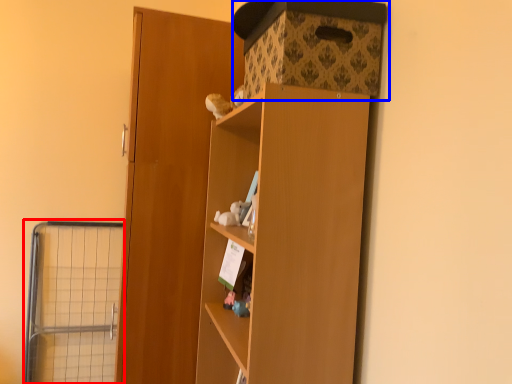
Question: Which of the following is the farthest to the observer, cage (highlighted by a red box) or storage box (highlighted by a blue box)?

Choices:
 (A) cage
 (B) storage box

Answer: (A)